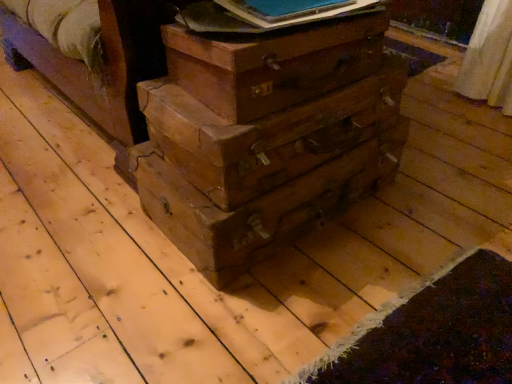
Question: From the image's perspective, is blue paper at upper center beneath wooden drawer at center, which is counted as the 1th drawer, starting from the bottom?

Choices:
 (A) no
 (B) yes

Answer: (A)

Question: Is blue paper at upper center positioned with its back to wooden drawer at center, placed as the second drawer when sorted from top to bottom?

Choices:
 (A) yes
 (B) no

Answer: (B)

Question: Is blue paper at upper center outside of wooden drawer at center, placed as the second drawer when sorted from top to bottom?

Choices:
 (A) no
 (B) yes

Answer: (B)

Question: Is blue paper at upper center to the left of wooden drawer at center, which is counted as the 1th drawer, starting from the bottom, from the viewer's perspective?

Choices:
 (A) no
 (B) yes

Answer: (A)

Question: Is blue paper at upper center directly adjacent to wooden drawer at center, which is counted as the 1th drawer, starting from the bottom?

Choices:
 (A) yes
 (B) no

Answer: (B)

Question: Considering the positions of point (352, 4) and point (160, 135), is point (352, 4) closer or farther from the camera than point (160, 135)?

Choices:
 (A) closer
 (B) farther

Answer: (A)

Question: Relative to wooden drawer at center, which is the 1th drawer from top to bottom, is blue paper at upper center in front or behind?

Choices:
 (A) behind
 (B) front

Answer: (A)

Question: In terms of width, does blue paper at upper center look wider or thinner when compared to wooden drawer at center, the second drawer positioned from the bottom?

Choices:
 (A) thin
 (B) wide

Answer: (A)

Question: Considering the positions of blue paper at upper center and wooden drawer at center, which is the 1th drawer from top to bottom, in the image, is blue paper at upper center bigger or smaller than wooden drawer at center, which is the 1th drawer from top to bottom,?

Choices:
 (A) big
 (B) small

Answer: (B)

Question: Is wooden drawer at center, which is counted as the 1th drawer, starting from the bottom, bigger or smaller than wooden drawer at center, which is the 1th drawer from top to bottom?

Choices:
 (A) small
 (B) big

Answer: (B)

Question: From the image's perspective, relative to wooden drawer at center, which is the 1th drawer from top to bottom, is wooden drawer at center, which is counted as the 1th drawer, starting from the bottom, above or below?

Choices:
 (A) above
 (B) below

Answer: (B)

Question: Is wooden drawer at center, placed as the second drawer when sorted from top to bottom, inside or outside of wooden drawer at center, the second drawer positioned from the bottom?

Choices:
 (A) inside
 (B) outside

Answer: (B)

Question: Relative to wooden drawer at center, the second drawer positioned from the bottom, is wooden drawer at center, which is counted as the 1th drawer, starting from the bottom, in front or behind?

Choices:
 (A) front
 (B) behind

Answer: (B)

Question: Relative to blue paper at upper center, is wooden suitcase at center in front or behind?

Choices:
 (A) front
 (B) behind

Answer: (A)

Question: Do you think wooden suitcase at center is within blue paper at upper center, or outside of it?

Choices:
 (A) inside
 (B) outside

Answer: (B)